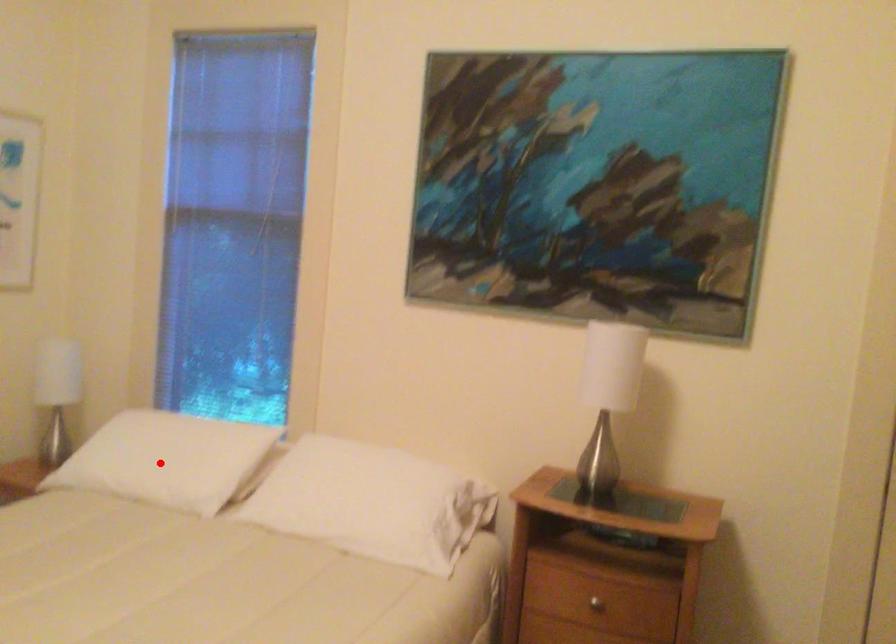
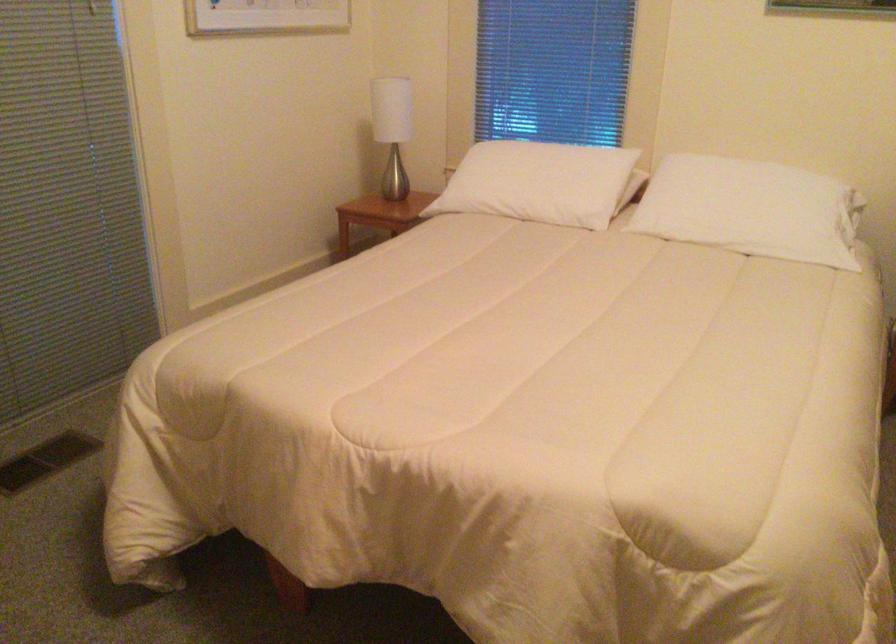
The point at the highlighted location is marked in the first image. Where is the corresponding point in the second image?

(538, 183)